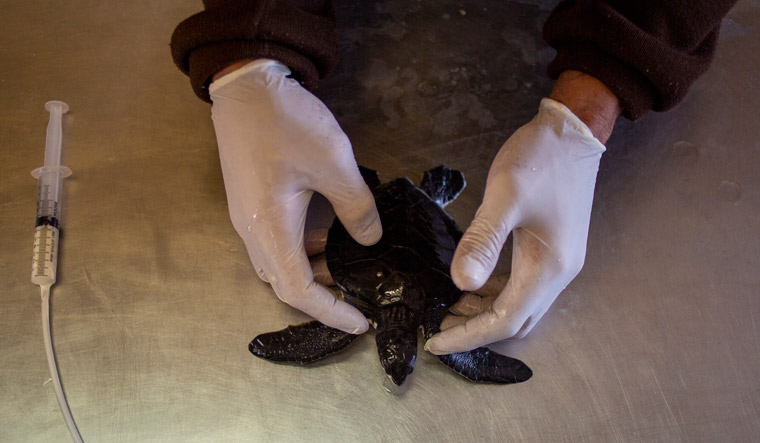
Find the location of a particular element. plunger flange is located at coordinates (58, 100).